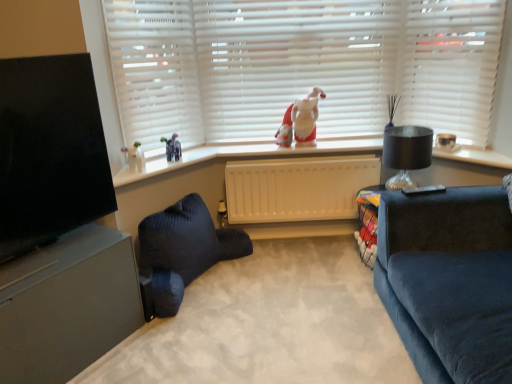
The width and height of the screenshot is (512, 384). What are the coordinates of `vacant space situated above matte gray entertainment center at lower left (from a real-world perspective)` in the screenshot? It's located at (40, 256).